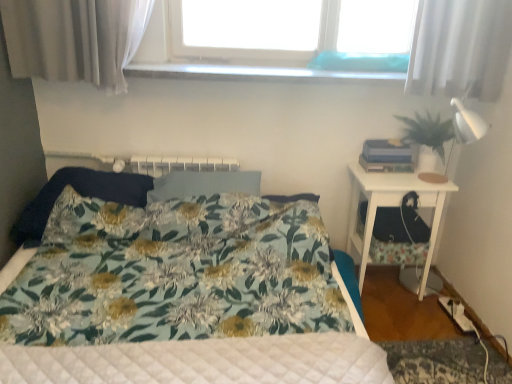
Where is `vacant region above clear glass window sill at upper center (from a real-world perspective)`? vacant region above clear glass window sill at upper center (from a real-world perspective) is located at coordinates (281, 67).